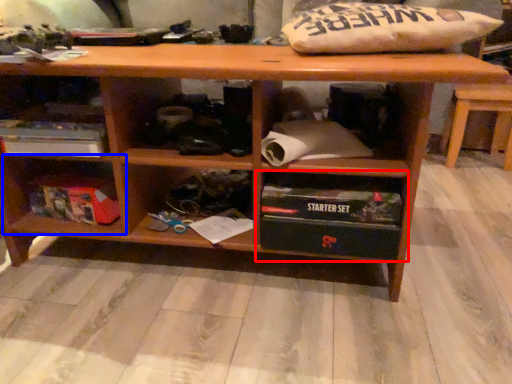
Question: Which point is further to the camera, shelf (highlighted by a red box) or shelf (highlighted by a blue box)?

Choices:
 (A) shelf
 (B) shelf

Answer: (B)